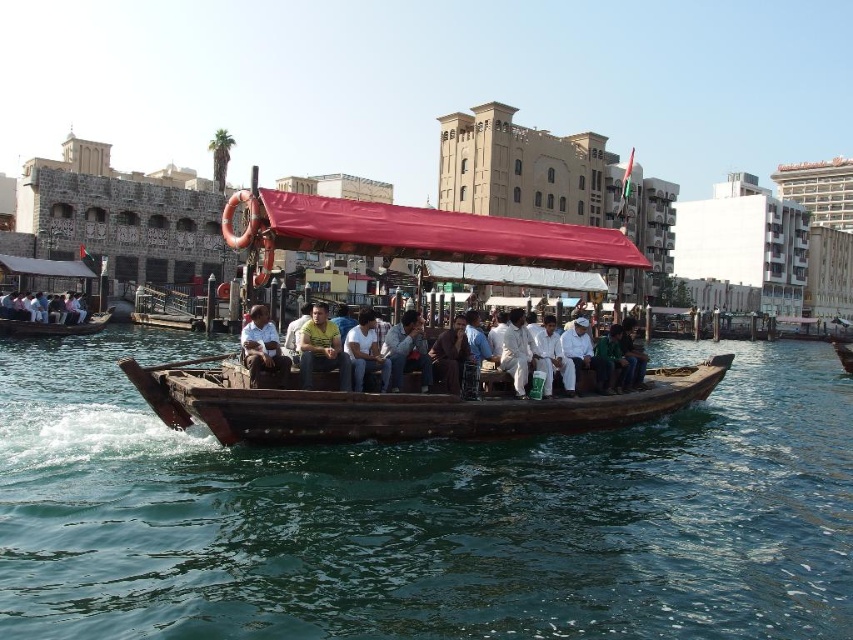
You are a tourist standing on the dock and see the point at coordinates (x=321, y=348). What is the nearest object to that point?

The point at coordinates (x=321, y=348) is on the yellow cotton shirt at center, so the nearest object to that point is the yellow cotton shirt at center.